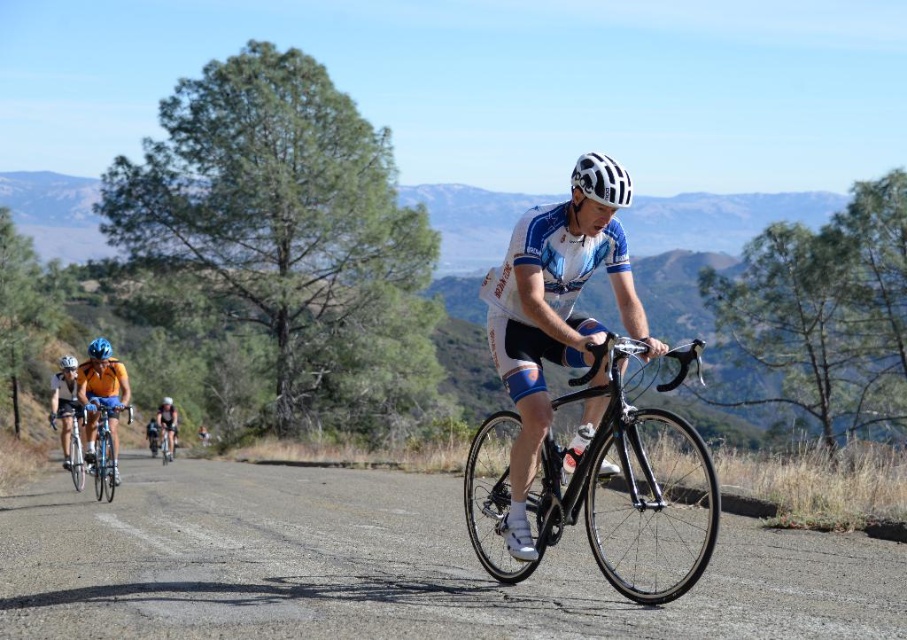
Which of these two, black rubber road bike at center or orange jersey cyclist at left, stands taller?

orange jersey cyclist at left

Between point (579, 634) and point (122, 365), which one is positioned in front?

Point (579, 634) is in front.

Identify the location of black rubber road bike at center. (386, 566).

Between point (80, 429) and point (80, 486), which one is positioned behind?

Point (80, 486)

Who is more distant from viewer, (70, 435) or (72, 438)?

Point (70, 435)

Where is `matte orange jersey at left`? matte orange jersey at left is located at coordinates (65, 404).

Is point (542, 392) positioned behind point (112, 472)?

That is False.

Find the location of `white matte cycling jersey at center`. white matte cycling jersey at center is located at coordinates (551, 323).

Is point (567, 317) behind point (100, 428)?

No, (567, 317) is in front of (100, 428).

Locate an element on the screen. white matte cycling jersey at center is located at coordinates (551, 323).